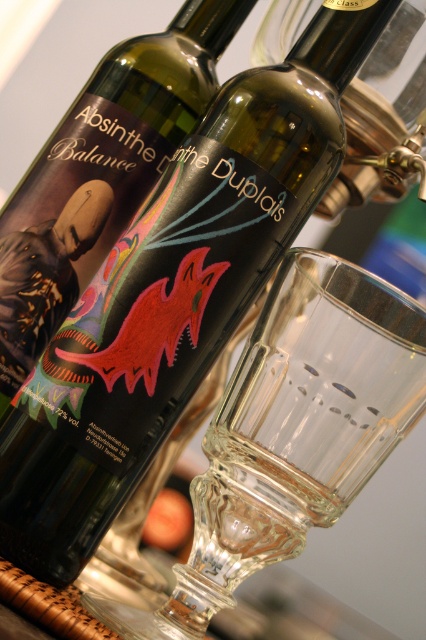
Question: Which of the following is the farthest from the observer?

Choices:
 (A) transparent glass at center
 (B) matte black absinthe balance bottle at center

Answer: (B)

Question: Can you confirm if transparent glass at center is wider than matte black absinthe balance bottle at center?

Choices:
 (A) yes
 (B) no

Answer: (A)

Question: Which of the following is the closest to the observer?

Choices:
 (A) transparent glass at center
 (B) matte black absinthe balance bottle at center

Answer: (A)

Question: Which object appears closest to the camera in this image?

Choices:
 (A) matte black absinthe balance bottle at center
 (B) transparent glass at center

Answer: (B)

Question: Is transparent glass at center closer to camera compared to matte black absinthe balance bottle at center?

Choices:
 (A) no
 (B) yes

Answer: (B)

Question: Is transparent glass at center below matte black absinthe balance bottle at center?

Choices:
 (A) yes
 (B) no

Answer: (A)